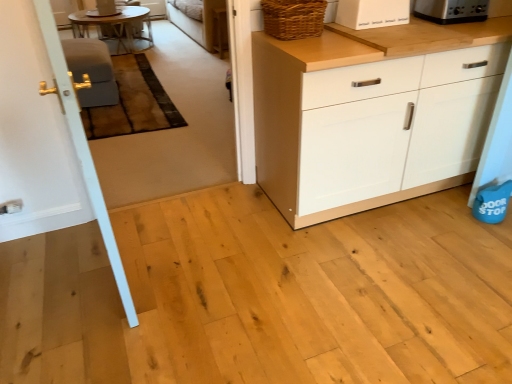
Question: Can you confirm if white matte bread box at upper right, which is counted as the 3th appliance, starting from the back, is positioned to the left of matte gray armchair at left?

Choices:
 (A) no
 (B) yes

Answer: (A)

Question: Can you confirm if white matte bread box at upper right, which is the 1th appliance in front-to-back order, is smaller than matte gray armchair at left?

Choices:
 (A) no
 (B) yes

Answer: (B)

Question: Does white matte bread box at upper right, which is the 2th appliance from left to right, have a greater height compared to matte gray armchair at left?

Choices:
 (A) no
 (B) yes

Answer: (A)

Question: Is white matte bread box at upper right, which is the 1th appliance in front-to-back order, closer to the viewer compared to matte gray armchair at left?

Choices:
 (A) yes
 (B) no

Answer: (A)

Question: From a real-world perspective, is white matte bread box at upper right, which appears as the third appliance when viewed from the top, positioned under matte gray armchair at left based on gravity?

Choices:
 (A) yes
 (B) no

Answer: (B)

Question: Considering the positions of satin silver toaster at upper right, marked as the 3th appliance in a left-to-right arrangement, and white painted wood door at left in the image, is satin silver toaster at upper right, marked as the 3th appliance in a left-to-right arrangement, taller or shorter than white painted wood door at left?

Choices:
 (A) tall
 (B) short

Answer: (B)

Question: From a real-world perspective, is satin silver toaster at upper right, marked as the second appliance in a bottom-to-top arrangement, physically located above or below white painted wood door at left?

Choices:
 (A) below
 (B) above

Answer: (B)

Question: Considering their positions, is satin silver toaster at upper right, the 2th appliance when ordered from back to front, located in front of or behind white painted wood door at left?

Choices:
 (A) behind
 (B) front

Answer: (A)

Question: From the image's perspective, is satin silver toaster at upper right, marked as the second appliance in a bottom-to-top arrangement, located above or below white painted wood door at left?

Choices:
 (A) below
 (B) above

Answer: (B)

Question: Considering the positions of point (48, 223) and point (201, 36), is point (48, 223) closer or farther from the camera than point (201, 36)?

Choices:
 (A) closer
 (B) farther

Answer: (A)

Question: From the image's perspective, is white painted wood door at left positioned above or below beige fabric couch at upper center?

Choices:
 (A) above
 (B) below

Answer: (B)

Question: From their relative heights in the image, would you say white painted wood door at left is taller or shorter than beige fabric couch at upper center?

Choices:
 (A) short
 (B) tall

Answer: (B)

Question: From a real-world perspective, is white painted wood door at left physically located above or below beige fabric couch at upper center?

Choices:
 (A) above
 (B) below

Answer: (A)

Question: From a real-world perspective, relative to satin silver toaster at upper right, which appears as the 2th appliance when viewed from the top, is woven brown basket at upper right vertically above or below?

Choices:
 (A) above
 (B) below

Answer: (A)

Question: Is woven brown basket at upper right to the left or to the right of satin silver toaster at upper right, which appears as the 2th appliance when viewed from the top, in the image?

Choices:
 (A) right
 (B) left

Answer: (B)